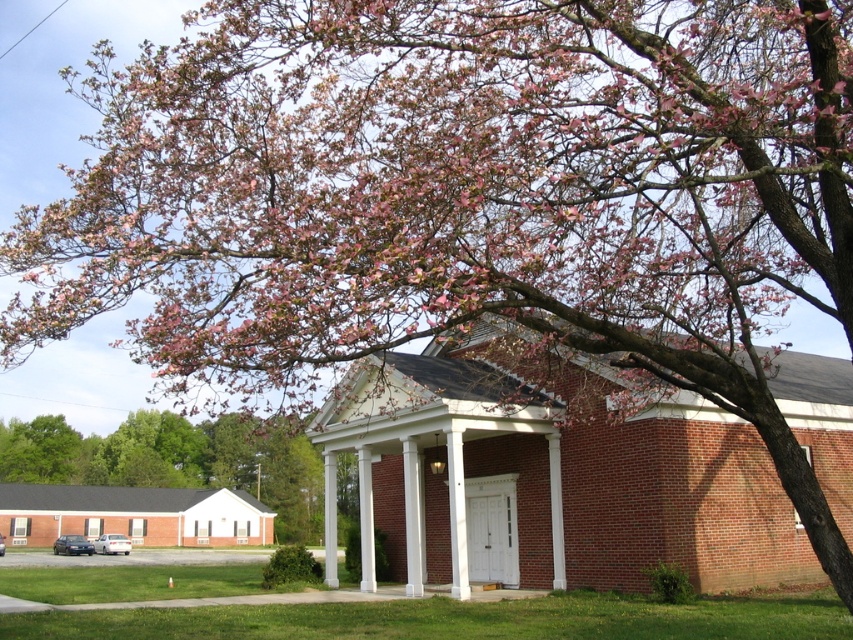
Is white brick porch at center bigger than pink blossom tree at upper left?

No, white brick porch at center is not bigger than pink blossom tree at upper left.

Can you confirm if white brick porch at center is smaller than pink blossom tree at upper left?

Correct, white brick porch at center occupies less space than pink blossom tree at upper left.

Where is `white brick porch at center`? The image size is (853, 640). white brick porch at center is located at coordinates (558, 468).

Does point (55, 364) lie behind point (372, 545)?

Yes, point (55, 364) is behind point (372, 545).

Where is `pink bloom at upper center`? The width and height of the screenshot is (853, 640). pink bloom at upper center is located at coordinates (57, 83).

Between pink bloom at upper center and pink blossom tree at upper left, which one appears on the left side from the viewer's perspective?

pink blossom tree at upper left

You are a GUI agent. You are given a task and a screenshot of the screen. Output one action in this format:
    pyautogui.click(x=<x>, y=<y>)
    Task: Click on the pink bloom at upper center
    
    Given the screenshot: What is the action you would take?
    pyautogui.click(x=57, y=83)